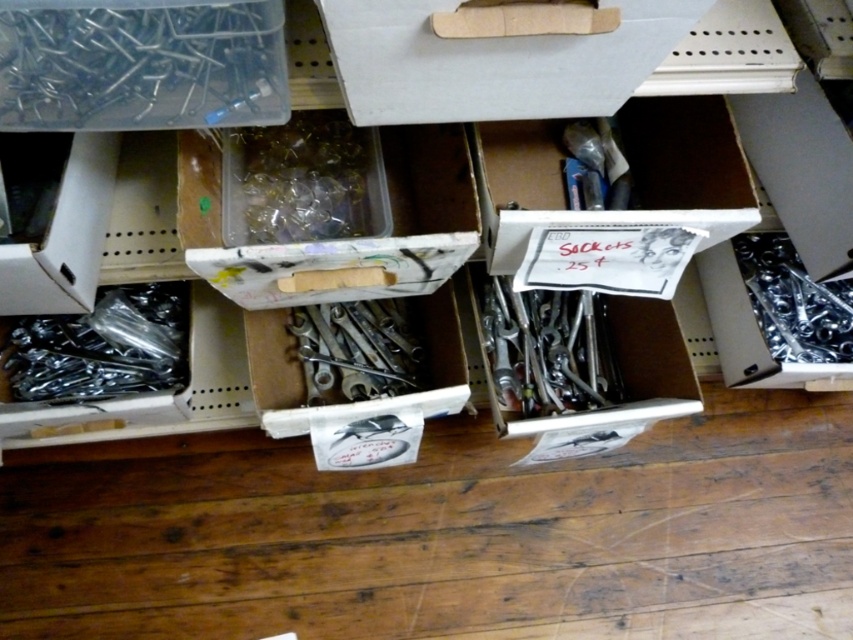
You are organizing a tool inventory and need to determine storage space requirements. Considering the clear plastic nails at upper left and the metallic wrenches at center, which item requires less storage space?

The clear plastic nails at upper left require less storage space since they have a smaller size compared to the metallic wrenches at center.

You are standing in the workshop and see two points marked on the wall. The first point is at coordinates point [386,326] and the second is at point [784,284]. Which point is closer to you?

Point [386,326] is closer to the viewer than point [784,284].